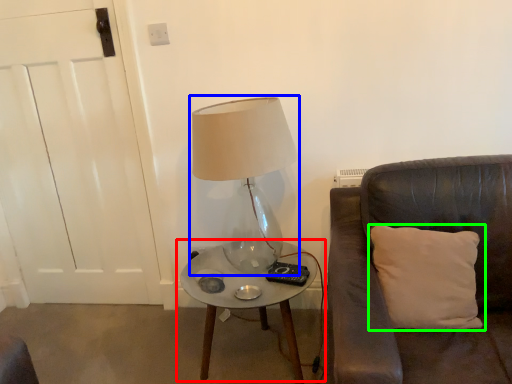
Question: Based on their relative distances, which object is farther from table (highlighted by a red box)? Choose from lamp (highlighted by a blue box) and pillow (highlighted by a green box).

Choices:
 (A) lamp
 (B) pillow

Answer: (A)